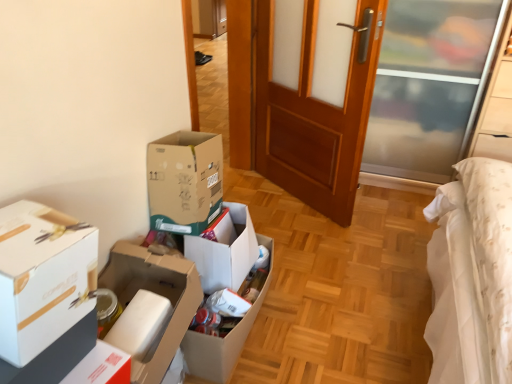
Question: Is white cardboard box at left, the first box from the front, taller or shorter than white cardboard box at center, positioned as the 2th box in back-to-front order?

Choices:
 (A) tall
 (B) short

Answer: (A)

Question: Is white cardboard box at left, the first box from the front, inside or outside of white cardboard box at center, the second box when ordered from front to back?

Choices:
 (A) outside
 (B) inside

Answer: (A)

Question: Estimate the real-world distances between objects in this image. Which object is closer to the white cardboard box at center, the second box when ordered from front to back?

Choices:
 (A) wooden door at center
 (B) white cardboard box at left, the first box from the front
 (C) cardboard box at center, positioned as the third box in front-to-back order

Answer: (C)

Question: Which is farther from the cardboard box at center, positioned as the third box in front-to-back order?

Choices:
 (A) white cardboard box at center, the second box when ordered from front to back
 (B) wooden door at center
 (C) white cardboard box at left, which is the third box in back-to-front order

Answer: (B)